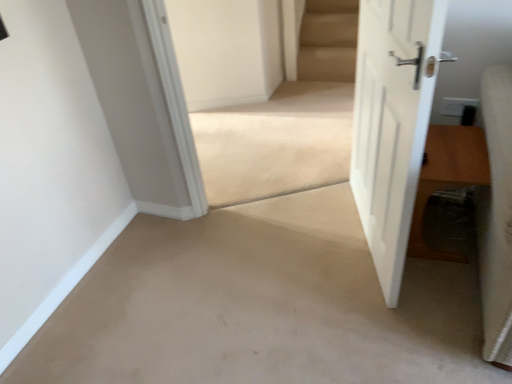
What do you see at coordinates (288, 120) in the screenshot?
I see `beige carpet at center` at bounding box center [288, 120].

Where is `white matte door at right`? The image size is (512, 384). white matte door at right is located at coordinates (393, 122).

Is point (390, 148) closer to camera compared to point (462, 139)?

That is True.

Is white matte door at right situated inside brown wooden table at right or outside?

white matte door at right is spatially situated outside brown wooden table at right.

From the image's perspective, who appears lower, white matte door at right or brown wooden table at right?

brown wooden table at right appears lower in the image.

Are white matte door at right and brown wooden table at right located far from each other?

Actually, white matte door at right and brown wooden table at right are a little close together.

Considering their positions, is beige carpet at center located in front of or behind white matte door at right?

beige carpet at center is behind white matte door at right.

Is beige carpet at center aimed at white matte door at right?

Yes, beige carpet at center faces towards white matte door at right.

From the image's perspective, is beige carpet at center above or below white matte door at right?

From the image's perspective, beige carpet at center appears above white matte door at right.

Considering the positions of objects beige carpet at center and white matte door at right in the image provided, who is more to the right, beige carpet at center or white matte door at right?

white matte door at right is more to the right.

How many degrees apart are the facing directions of brown wooden table at right and beige carpet at center?

The facing directions of brown wooden table at right and beige carpet at center are 28.2 degrees apart.

Image resolution: width=512 pixels, height=384 pixels. Find the location of `stairwell positioned vertically above the brown wooden table at right (from a real-world perspective)`. stairwell positioned vertically above the brown wooden table at right (from a real-world perspective) is located at coordinates (288, 120).

Does point (426, 140) come behind point (347, 126)?

No, it is in front of (347, 126).

Is brown wooden table at right oriented away from beige carpet at center?

No, brown wooden table at right's orientation is not away from beige carpet at center.

Consider the image. In the image, is white matte door at right positioned in front of or behind beige carpet at center?

Visually, white matte door at right is located in front of beige carpet at center.

Based on the photo, between white matte door at right and beige carpet at center, which one appears on the left side from the viewer's perspective?

beige carpet at center is more to the left.

Are white matte door at right and beige carpet at center making contact?

No, white matte door at right is not touching beige carpet at center.

Considering the positions of points (392, 271) and (238, 115), is point (392, 271) farther from camera compared to point (238, 115)?

No, (392, 271) is in front of (238, 115).

Could you tell me if brown wooden table at right is turned towards white matte door at right?

No, brown wooden table at right is not aimed at white matte door at right.

Is brown wooden table at right touching white matte door at right?

brown wooden table at right is not next to white matte door at right, and they're not touching.

Which object is further away from the camera, brown wooden table at right or white matte door at right?

brown wooden table at right.

Does brown wooden table at right appear on the left side of white matte door at right?

No, brown wooden table at right is not to the left of white matte door at right.

Is point (332, 57) farther from camera compared to point (466, 166)?

Yes, point (332, 57) is farther from viewer.

From a real-world perspective, does beige carpet at center sit lower than brown wooden table at right?

No.

Does beige carpet at center have a greater height compared to brown wooden table at right?

Yes, beige carpet at center is taller than brown wooden table at right.

Is beige carpet at center not close to brown wooden table at right?

beige carpet at center is near brown wooden table at right, not far away.

The width and height of the screenshot is (512, 384). Identify the location of hardwood located below the white matte door at right (from the image's perspective). (447, 177).

The height and width of the screenshot is (384, 512). What are the coordinates of `door on the right of the beige carpet at center` in the screenshot? It's located at (393, 122).

Which object lies nearer to the anchor point beige carpet at center, white matte door at right or brown wooden table at right?

white matte door at right is closer to beige carpet at center.

Considering their positions, is brown wooden table at right positioned further to beige carpet at center than white matte door at right?

brown wooden table at right.

Estimate the real-world distances between objects in this image. Which object is closer to white matte door at right, brown wooden table at right or beige carpet at center?

brown wooden table at right is closer to white matte door at right.

Estimate the real-world distances between objects in this image. Which object is further from brown wooden table at right, beige carpet at center or white matte door at right?

The object further to brown wooden table at right is beige carpet at center.

In the scene shown: From the image, which object appears to be nearer to white matte door at right, beige carpet at center or brown wooden table at right?

The object closer to white matte door at right is brown wooden table at right.

Which object lies nearer to the anchor point brown wooden table at right, white matte door at right or beige carpet at center?

The object closer to brown wooden table at right is white matte door at right.

You are a GUI agent. You are given a task and a screenshot of the screen. Output one action in this format:
    pyautogui.click(x=<x>, y=<y>)
    Task: Click on the door situated between beige carpet at center and brown wooden table at right from left to right
    This screenshot has height=384, width=512.
    Given the screenshot: What is the action you would take?
    pyautogui.click(x=393, y=122)